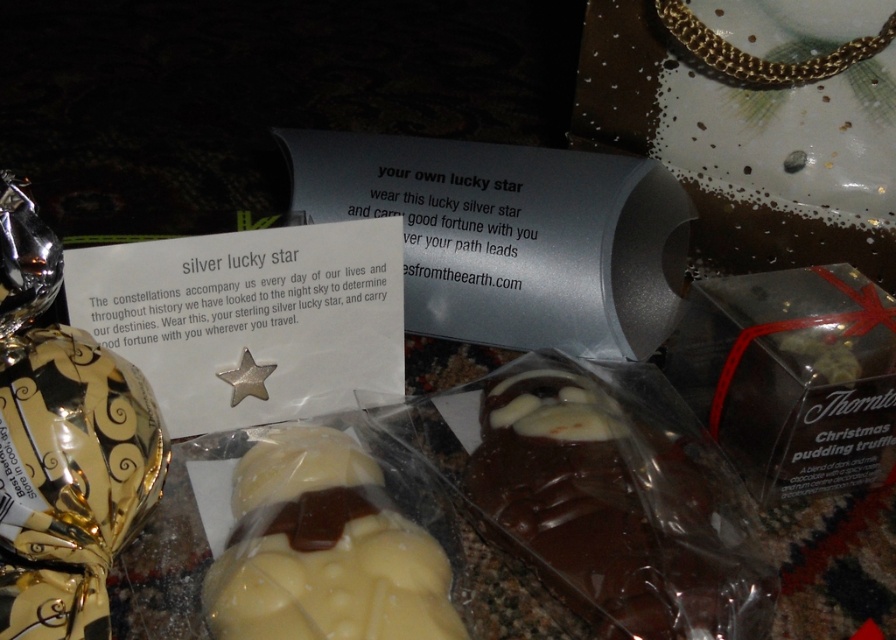
Between gold foil wrapped chocolate at lower left and white chocolate at center, which one is positioned higher?

Positioned higher is gold foil wrapped chocolate at lower left.

At what (x,y) coordinates should I click in order to perform the action: click on gold foil wrapped chocolate at lower left. Please return your answer as a coordinate pair (x, y). The width and height of the screenshot is (896, 640). Looking at the image, I should click on (69, 477).

Find the location of a particular element. The width and height of the screenshot is (896, 640). gold foil wrapped chocolate at lower left is located at coordinates (69, 477).

Does dark chocolate truffle at center have a greater height compared to white chocolate at center?

Yes.

Is point (567, 420) behind point (263, 580)?

Yes, point (567, 420) is farther from viewer.

Does point (661, 380) come in front of point (234, 595)?

No.

The width and height of the screenshot is (896, 640). In order to click on dark chocolate truffle at center in this screenshot , I will do `click(618, 509)`.

Which of these two, dark chocolate truffle at center or gold foil wrapped chocolate at lower left, stands shorter?

dark chocolate truffle at center

Consider the image. Is dark chocolate truffle at center shorter than gold foil wrapped chocolate at lower left?

Yes.

What do you see at coordinates (618, 509) in the screenshot?
I see `dark chocolate truffle at center` at bounding box center [618, 509].

Identify the location of dark chocolate truffle at center. tap(618, 509).